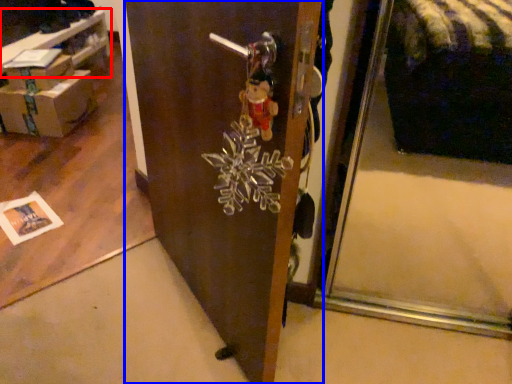
Question: Among these objects, which one is nearest to the camera, table (highlighted by a red box) or door (highlighted by a blue box)?

Choices:
 (A) table
 (B) door

Answer: (B)